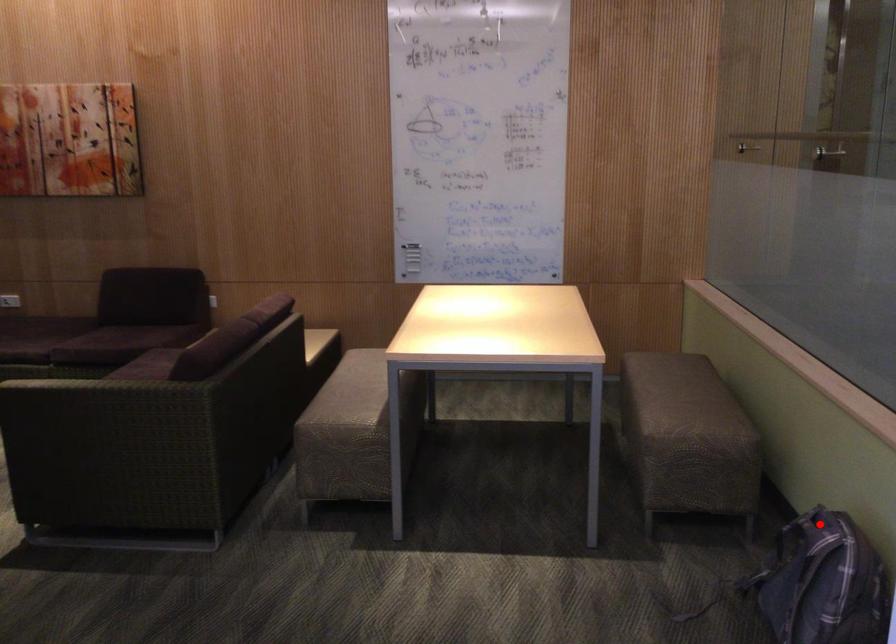
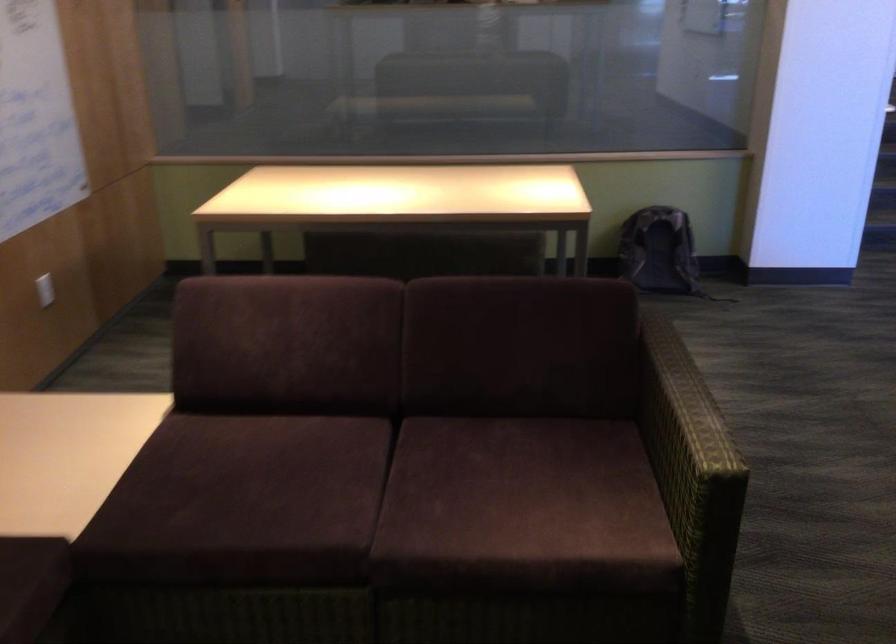
Question: I am providing you with two images of the same scene from different viewpoints. Image1 has a red point marked. In image2, the corresponding 3D location appears at what relative position? Reply with the corresponding letter.

Choices:
 (A) Closer
 (B) Farther

Answer: (B)